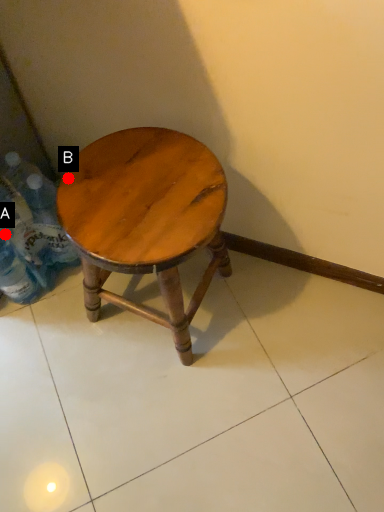
Question: Two points are circled on the image, labeled by A and B beside each circle. Which point is closer to the camera?

Choices:
 (A) A is closer
 (B) B is closer

Answer: (B)